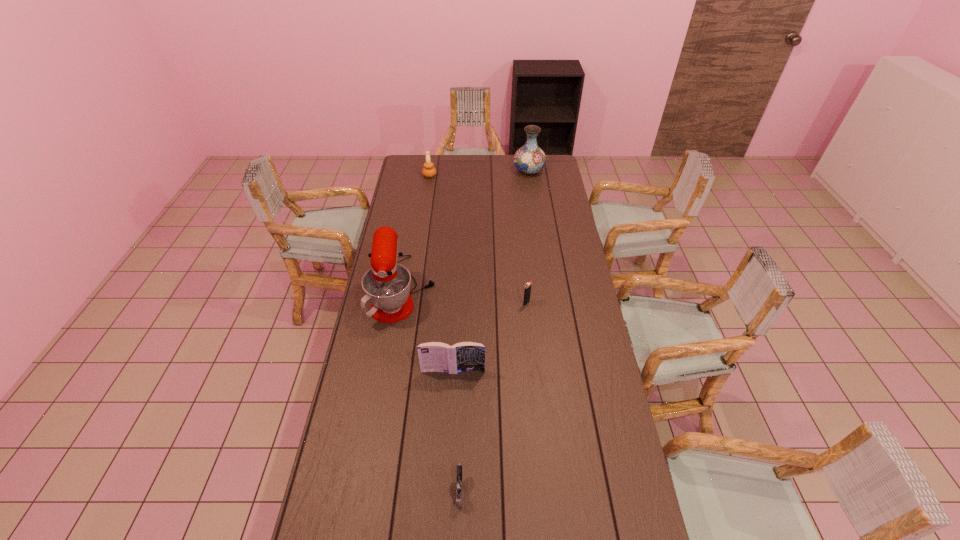
At what (x,y) coordinates should I click in order to perform the action: click on free space between the vase and the fifth farthest object. Please return your answer as a coordinate pair (x, y). This screenshot has width=960, height=540. Looking at the image, I should click on (491, 271).

At what (x,y) coordinates should I click in order to perform the action: click on free space between the mixer and the book. Please return your answer as a coordinate pair (x, y). Looking at the image, I should click on (428, 330).

Find the location of a particular element. The width and height of the screenshot is (960, 540). unoccupied position between the candle_holder and the fifth farthest object is located at coordinates (442, 273).

Identify the location of vacant area between the vase and the left igniter. This screenshot has width=960, height=540. (494, 329).

This screenshot has width=960, height=540. In order to click on the second closest object to the farther igniter in this screenshot , I will do `click(387, 285)`.

Find the location of `object that is the closest to the vase`. object that is the closest to the vase is located at coordinates (429, 171).

Find the location of `free space that satisfies the following two spatial constraints: 1. on the front cover of the fifth farthest object; 2. on the right side of the nearest object`. free space that satisfies the following two spatial constraints: 1. on the front cover of the fifth farthest object; 2. on the right side of the nearest object is located at coordinates [x=447, y=488].

Find the location of a particular element. free location that satisfies the following two spatial constraints: 1. on the back side of the left igniter; 2. on the bowl side of the mixer is located at coordinates (467, 289).

I want to click on vacant space that satisfies the following two spatial constraints: 1. on the bowl side of the mixer; 2. on the back side of the nearer igniter, so click(x=371, y=488).

In order to click on vacant space that satisfies the following two spatial constraints: 1. on the front side of the vase; 2. on the bowl side of the mixer in this screenshot , I will do `click(546, 289)`.